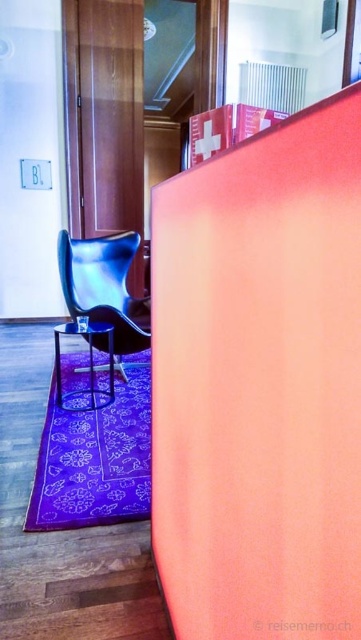
Question: Among these objects, which one is farthest from the camera?

Choices:
 (A) metallic stool at lower left
 (B) shiny blue leather armchair at lower left

Answer: (B)

Question: Is shiny blue leather armchair at lower left smaller than metallic stool at lower left?

Choices:
 (A) no
 (B) yes

Answer: (A)

Question: Is shiny blue leather armchair at lower left behind metallic stool at lower left?

Choices:
 (A) yes
 (B) no

Answer: (A)

Question: Among these objects, which one is farthest from the camera?

Choices:
 (A) metallic stool at lower left
 (B) shiny blue leather armchair at lower left

Answer: (B)

Question: Does shiny blue leather armchair at lower left appear on the right side of metallic stool at lower left?

Choices:
 (A) no
 (B) yes

Answer: (B)